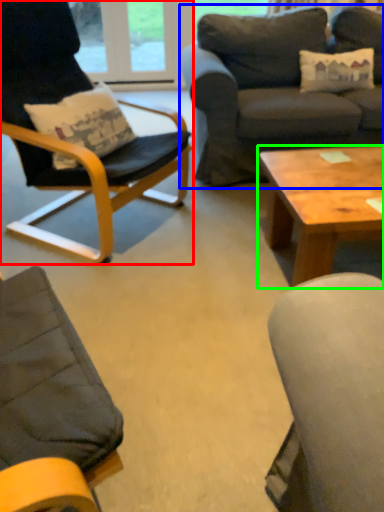
Question: Which object is positioned farthest from chair (highlighted by a red box)? Select from studio couch (highlighted by a blue box) and coffee table (highlighted by a green box).

Choices:
 (A) studio couch
 (B) coffee table

Answer: (A)